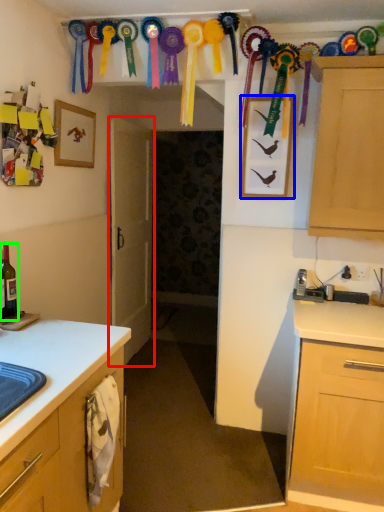
Question: Which is farther away from door (highlighted by a red box)? picture frame (highlighted by a blue box) or beer bottle (highlighted by a green box)?

Choices:
 (A) picture frame
 (B) beer bottle

Answer: (B)